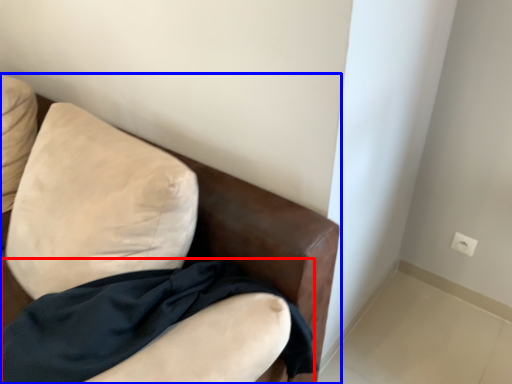
Question: Which point is further to the camera, fabric (highlighted by a red box) or furniture (highlighted by a blue box)?

Choices:
 (A) fabric
 (B) furniture

Answer: (A)